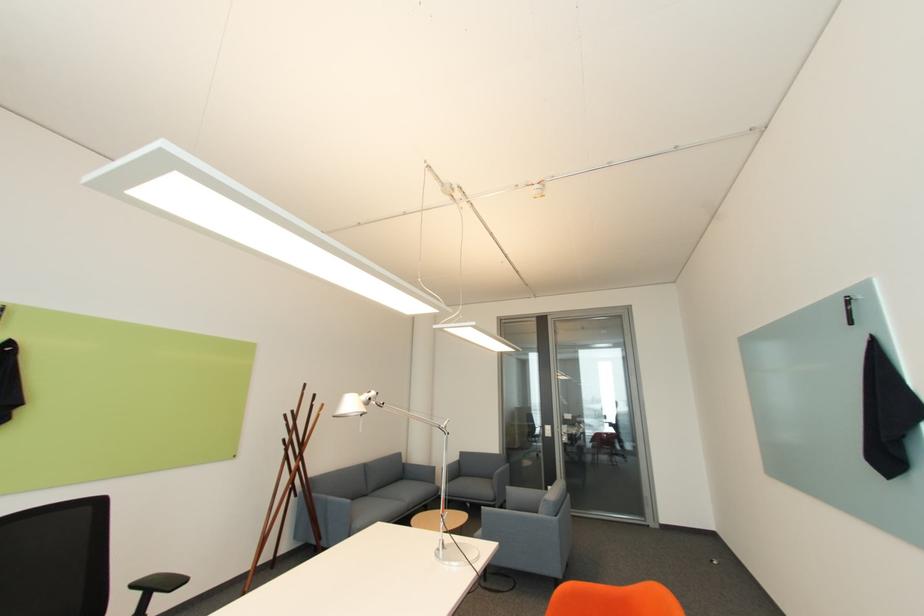
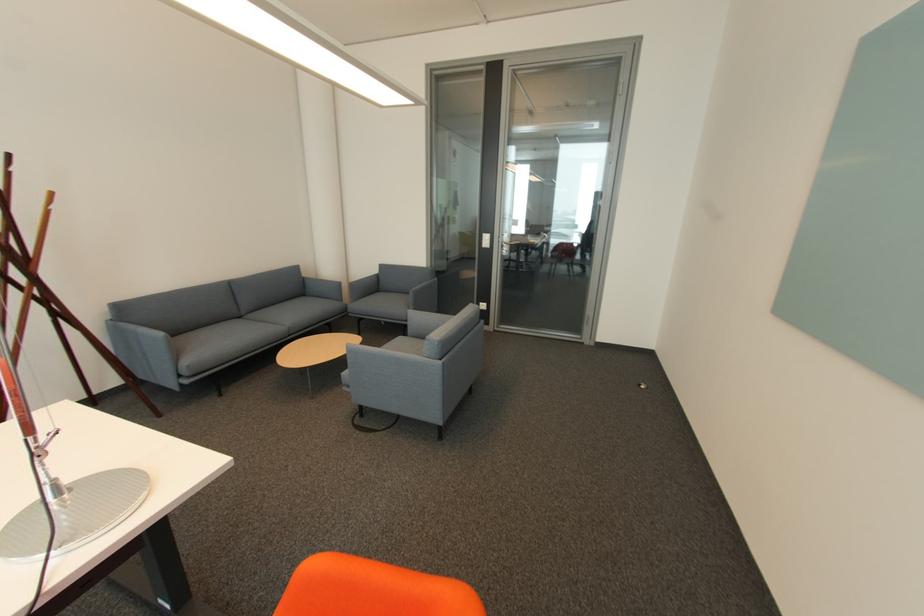
Locate, in the second image, the point that corresponds to the point at 331,496 in the first image.

(139, 328)